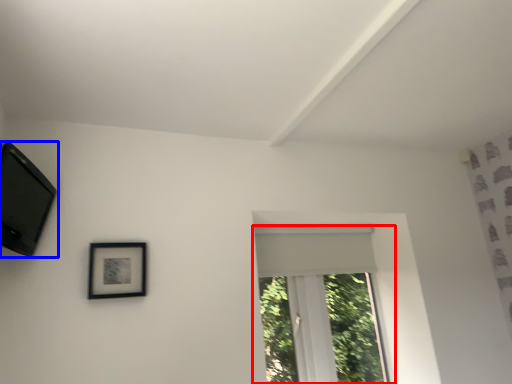
Question: Which of the following is the farthest to the observer, window (highlighted by a red box) or picture frame (highlighted by a blue box)?

Choices:
 (A) window
 (B) picture frame

Answer: (A)